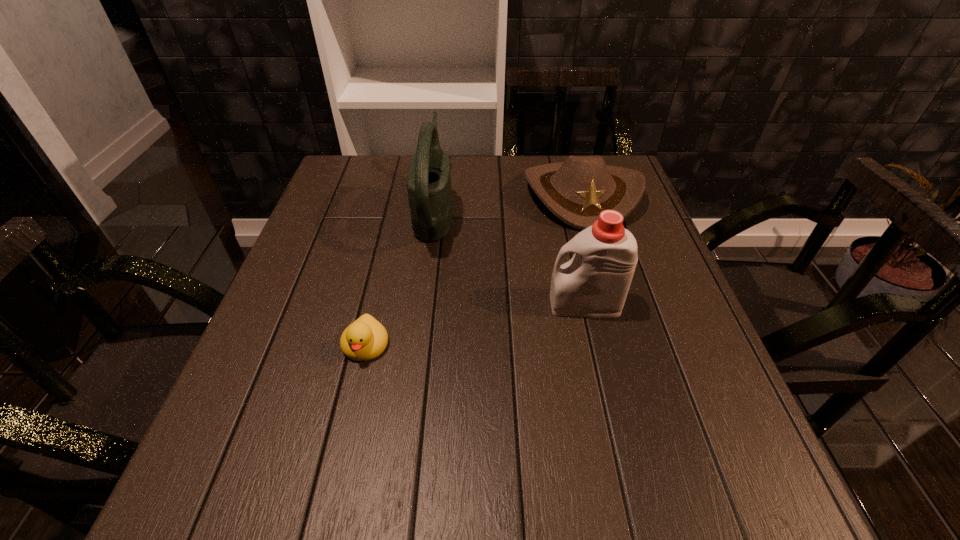
Locate an element on the screen. The width and height of the screenshot is (960, 540). object that is the closest to the third farthest object is located at coordinates (576, 191).

Locate an element on the screen. The height and width of the screenshot is (540, 960). object that is the third closest to the second object from left to right is located at coordinates (594, 284).

Identify the location of blank space that satisfies the following two spatial constraints: 1. with a star on the front of the third tallest object; 2. on the spout of the watering can. Image resolution: width=960 pixels, height=540 pixels. (586, 209).

This screenshot has height=540, width=960. Find the location of `free space that satisfies the following two spatial constraints: 1. with a star on the front of the cowboy hat; 2. on the handle side of the second nearest object`. free space that satisfies the following two spatial constraints: 1. with a star on the front of the cowboy hat; 2. on the handle side of the second nearest object is located at coordinates (613, 305).

In order to click on free region that satisfies the following two spatial constraints: 1. with a star on the front of the second shortest object; 2. on the spout of the second object from left to right in this screenshot , I will do `click(586, 209)`.

Identify the location of free spot that satisfies the following two spatial constraints: 1. on the handle side of the detergent; 2. on the face of the duckling. The width and height of the screenshot is (960, 540). (594, 345).

This screenshot has width=960, height=540. I want to click on blank space that satisfies the following two spatial constraints: 1. with a star on the front of the cowboy hat; 2. on the spout of the watering can, so click(586, 209).

In order to click on vacant space that satisfies the following two spatial constraints: 1. on the spout of the second object from left to right; 2. on the face of the duckling in this screenshot , I will do `click(417, 345)`.

Identify the location of vacant region that satisfies the following two spatial constraints: 1. on the handle side of the detergent; 2. on the face of the duckling. The image size is (960, 540). (594, 345).

Locate an element on the screen. The width and height of the screenshot is (960, 540). free spot that satisfies the following two spatial constraints: 1. with a star on the front of the third tallest object; 2. on the spout of the watering can is located at coordinates (586, 209).